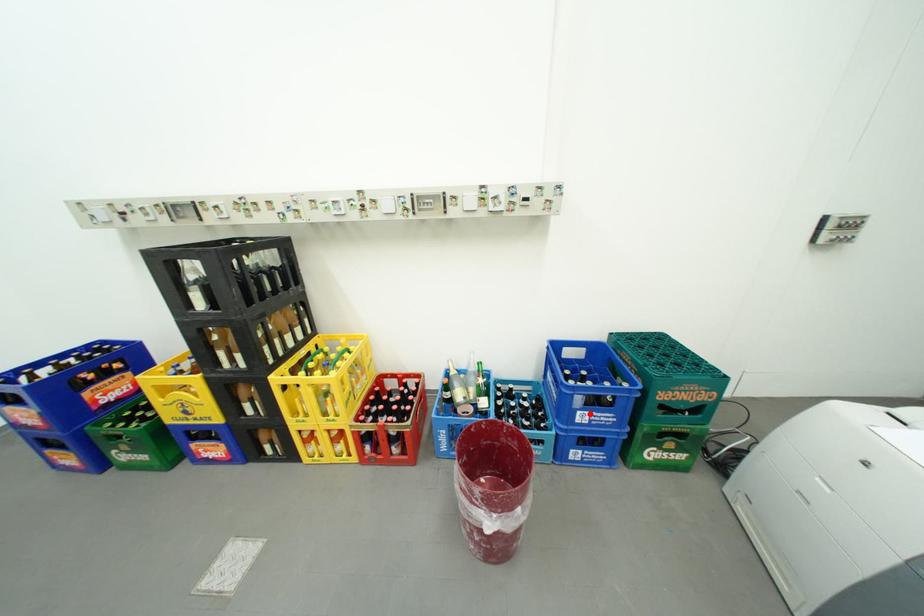
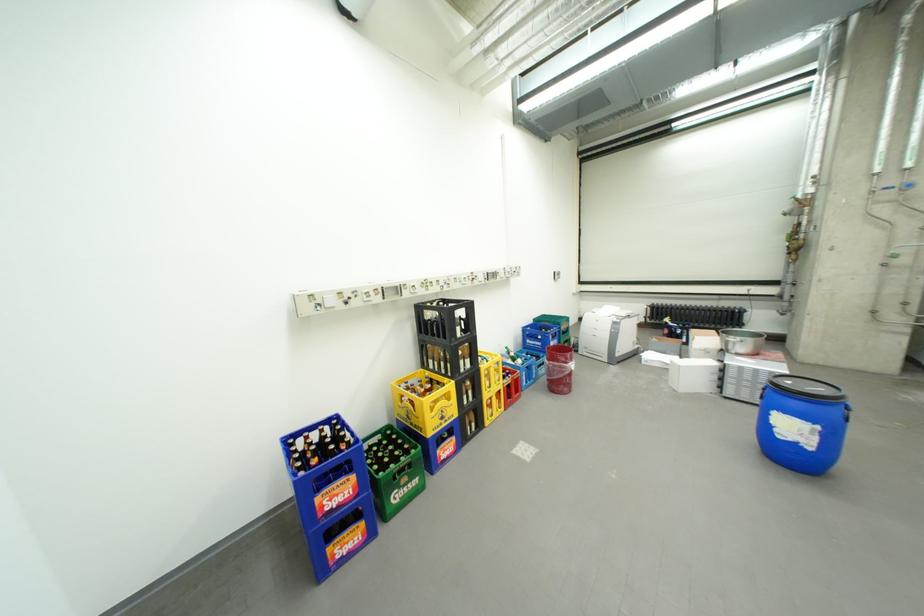
Where in the second image is the point corresponding to the highlighted location from the first image?

(562, 344)